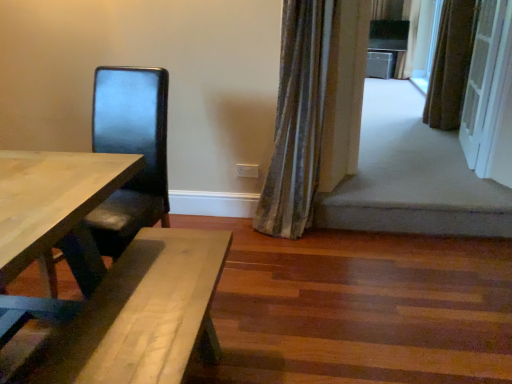
The width and height of the screenshot is (512, 384). Find the location of `brown textured curtain at upper right, which is the second curtain from top to bottom`. brown textured curtain at upper right, which is the second curtain from top to bottom is located at coordinates (451, 64).

In order to face brown textured curtain at upper right, which is the second curtain from top to bottom, should I rotate leftwards or rightwards?

Rotate your view right by about 24.248°.

At what (x,y) coordinates should I click in order to perform the action: click on white textured screen door at upper right. Please return your answer as a coordinate pair (x, y). Looking at the image, I should click on (481, 77).

Where is `velvet-like curtain at upper right, the 1th curtain viewed from the front`? The image size is (512, 384). velvet-like curtain at upper right, the 1th curtain viewed from the front is located at coordinates (297, 119).

Between striped fabric curtain at upper right, the 3th curtain from the left, and velvet-like curtain at upper right, acting as the 1th curtain starting from the bottom, which one has smaller width?

velvet-like curtain at upper right, acting as the 1th curtain starting from the bottom.

Is the depth of striped fabric curtain at upper right, which appears as the first curtain when viewed from the top, less than that of velvet-like curtain at upper right, which ranks as the third curtain in top-to-bottom order?

No, it is not.

Is striped fabric curtain at upper right, the 3th curtain from the left, taller or shorter than velvet-like curtain at upper right, the 1th curtain viewed from the front?

In the image, striped fabric curtain at upper right, the 3th curtain from the left, appears to be shorter than velvet-like curtain at upper right, the 1th curtain viewed from the front.

From a real-world perspective, between striped fabric curtain at upper right, positioned as the 1th curtain in back-to-front order, and velvet-like curtain at upper right, the 3th curtain positioned from the right, who is vertically higher?

striped fabric curtain at upper right, positioned as the 1th curtain in back-to-front order, is physically above.

Is white textured screen door at upper right to the right of matte black chair at left from the viewer's perspective?

Indeed, white textured screen door at upper right is positioned on the right side of matte black chair at left.

Consider the image. From the image's perspective, is white textured screen door at upper right below matte black chair at left?

Incorrect, from the image's perspective, white textured screen door at upper right is higher than matte black chair at left.

How distant is white textured screen door at upper right from matte black chair at left?

7.50 feet.

Considering the relative sizes of white textured screen door at upper right and matte black chair at left in the image provided, is white textured screen door at upper right wider than matte black chair at left?

No.

Between matte black chair at left and striped fabric curtain at upper right, placed as the third curtain when sorted from bottom to top, which one has smaller size?

striped fabric curtain at upper right, placed as the third curtain when sorted from bottom to top, is smaller.

How many degrees apart are the facing directions of matte black chair at left and striped fabric curtain at upper right, which is counted as the 1th curtain, starting from the right?

88.1 degrees.

Can you see matte black chair at left touching striped fabric curtain at upper right, the 3th curtain when ordered from front to back?

matte black chair at left and striped fabric curtain at upper right, the 3th curtain when ordered from front to back, are not in contact.

Relative to velvet-like curtain at upper right, the 1th curtain viewed from the front, is white textured screen door at upper right in front or behind?

white textured screen door at upper right is positioned farther from the viewer than velvet-like curtain at upper right, the 1th curtain viewed from the front.

Is white textured screen door at upper right aimed at velvet-like curtain at upper right, the 3th curtain positioned from the right?

No, white textured screen door at upper right is not oriented towards velvet-like curtain at upper right, the 3th curtain positioned from the right.

Looking at the image, does white textured screen door at upper right seem bigger or smaller compared to velvet-like curtain at upper right, the 1th curtain viewed from the front?

Considering their sizes, white textured screen door at upper right takes up less space than velvet-like curtain at upper right, the 1th curtain viewed from the front.

Is white textured screen door at upper right at the right side of velvet-like curtain at upper right, acting as the 1th curtain starting from the bottom?

Correct, you'll find white textured screen door at upper right to the right of velvet-like curtain at upper right, acting as the 1th curtain starting from the bottom.

In the scene shown: Which is farther, (311, 205) or (469, 25)?

The point (469, 25) is farther.

Is velvet-like curtain at upper right, acting as the 1th curtain starting from the bottom, oriented towards brown textured curtain at upper right, which is the second curtain from top to bottom?

No, velvet-like curtain at upper right, acting as the 1th curtain starting from the bottom, is not turned towards brown textured curtain at upper right, which is the second curtain from top to bottom.

From the image's perspective, which is above, white textured screen door at upper right or striped fabric curtain at upper right, the 3th curtain from the left?

striped fabric curtain at upper right, the 3th curtain from the left, from the image's perspective.

Does white textured screen door at upper right have a lesser height compared to striped fabric curtain at upper right, the 3th curtain when ordered from front to back?

Indeed, white textured screen door at upper right has a lesser height compared to striped fabric curtain at upper right, the 3th curtain when ordered from front to back.

Consider the image. Is white textured screen door at upper right oriented away from striped fabric curtain at upper right, which is counted as the 1th curtain, starting from the right?

white textured screen door at upper right is not turned away from striped fabric curtain at upper right, which is counted as the 1th curtain, starting from the right.

Is white textured screen door at upper right to the right of striped fabric curtain at upper right, which appears as the first curtain when viewed from the top, from the viewer's perspective?

Incorrect, white textured screen door at upper right is not on the right side of striped fabric curtain at upper right, which appears as the first curtain when viewed from the top.

Is brown textured curtain at upper right, the 2th curtain positioned from the back, situated inside white textured screen door at upper right or outside?

brown textured curtain at upper right, the 2th curtain positioned from the back, exists outside the volume of white textured screen door at upper right.

Is brown textured curtain at upper right, the 2th curtain positioned from the back, in front of or behind white textured screen door at upper right in the image?

brown textured curtain at upper right, the 2th curtain positioned from the back, is positioned farther from the viewer than white textured screen door at upper right.

Does brown textured curtain at upper right, the 2th curtain positioned from the back, have a larger size compared to white textured screen door at upper right?

Indeed, brown textured curtain at upper right, the 2th curtain positioned from the back, has a larger size compared to white textured screen door at upper right.

From the image's perspective, which one is positioned lower, brown textured curtain at upper right, the 2th curtain positioned from the back, or white textured screen door at upper right?

From the image's view, white textured screen door at upper right is below.

From the image's perspective, which curtain is the 2nd one above the velvet-like curtain at upper right, the 1th curtain viewed from the front? Please provide its 2D coordinates.

[(408, 39)]

Identify the location of screen door positioned vertically above the matte black chair at left (from a real-world perspective). (481, 77).

Considering their positions, is striped fabric curtain at upper right, positioned as the 1th curtain in back-to-front order, positioned closer to matte black chair at left than white textured screen door at upper right?

Among the two, white textured screen door at upper right is located nearer to matte black chair at left.

From the image, which object appears to be nearer to white textured screen door at upper right, matte black chair at left or striped fabric curtain at upper right, placed as the third curtain when sorted from bottom to top?

matte black chair at left lies closer to white textured screen door at upper right than the other object.

Which object lies further to the anchor point brown textured curtain at upper right, positioned as the 2th curtain in front-to-back order, matte black chair at left or striped fabric curtain at upper right, placed as the third curtain when sorted from bottom to top?

matte black chair at left is positioned further to the anchor brown textured curtain at upper right, positioned as the 2th curtain in front-to-back order.

Considering their positions, is brown textured curtain at upper right, the second curtain in the left-to-right sequence, positioned further to striped fabric curtain at upper right, which is counted as the 1th curtain, starting from the right, than white textured screen door at upper right?

white textured screen door at upper right is further to striped fabric curtain at upper right, which is counted as the 1th curtain, starting from the right.

Consider the image. Considering their positions, is striped fabric curtain at upper right, which appears as the first curtain when viewed from the top, positioned closer to brown textured curtain at upper right, the 2th curtain in the right-to-left sequence, than white textured screen door at upper right?

white textured screen door at upper right is closer to brown textured curtain at upper right, the 2th curtain in the right-to-left sequence.

Looking at this image, when comparing their distances from matte black chair at left, does velvet-like curtain at upper right, the 1th curtain viewed from the front, or striped fabric curtain at upper right, which appears as the first curtain when viewed from the top, seem closer?

Based on the image, velvet-like curtain at upper right, the 1th curtain viewed from the front, appears to be nearer to matte black chair at left.

Consider the image. Based on their spatial positions, is matte black chair at left or velvet-like curtain at upper right, the third curtain viewed from the back, closer to brown textured curtain at upper right, the 2th curtain in the right-to-left sequence?

velvet-like curtain at upper right, the third curtain viewed from the back, is positioned closer to the anchor brown textured curtain at upper right, the 2th curtain in the right-to-left sequence.

Estimate the real-world distances between objects in this image. Which object is closer to striped fabric curtain at upper right, positioned as the 1th curtain in back-to-front order, matte black chair at left or velvet-like curtain at upper right, the 3th curtain positioned from the right?

velvet-like curtain at upper right, the 3th curtain positioned from the right, is closer to striped fabric curtain at upper right, positioned as the 1th curtain in back-to-front order.

This screenshot has width=512, height=384. What are the coordinates of `screen door between matte black chair at left and brown textured curtain at upper right, the second curtain in the left-to-right sequence` in the screenshot? It's located at (481, 77).

The height and width of the screenshot is (384, 512). Identify the location of curtain between white textured screen door at upper right and striped fabric curtain at upper right, which appears as the first curtain when viewed from the top, in the front-back direction. (451, 64).

At what (x,y) coordinates should I click in order to perform the action: click on curtain located between matte black chair at left and brown textured curtain at upper right, positioned as the 2th curtain in front-to-back order, in the left-right direction. Please return your answer as a coordinate pair (x, y). Looking at the image, I should click on (297, 119).

Identify the location of screen door between matte black chair at left and striped fabric curtain at upper right, the 3th curtain when ordered from front to back, in the front-back direction. This screenshot has width=512, height=384. pyautogui.click(x=481, y=77).